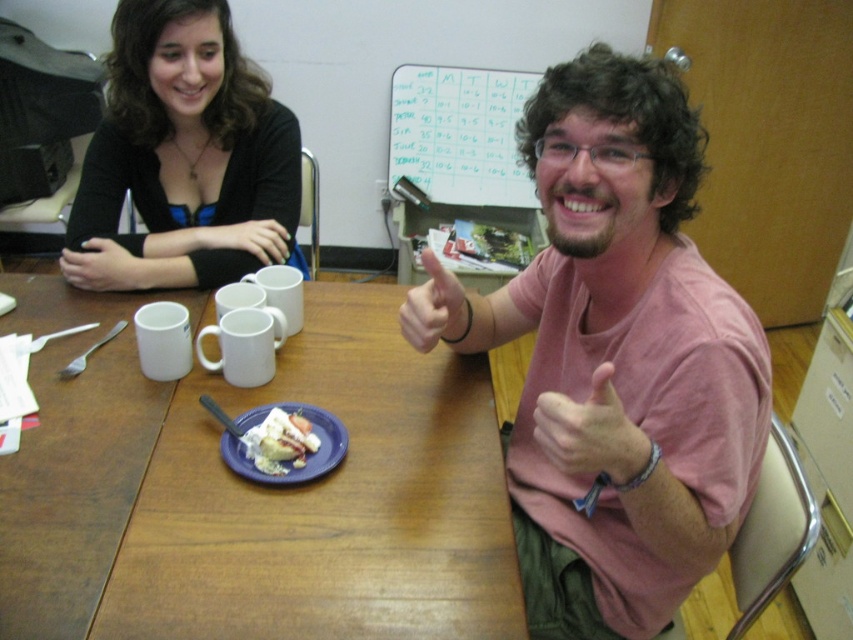
You are a delivery person who needs to place a small package between the pink cotton shirt at center and the black matte sweater at upper left. Can you fit the package if it measures 30 inches in length?

The distance between the pink cotton shirt at center and the black matte sweater at upper left is 29.75 inches, so the package measuring 30 inches in length cannot fit between them as it is slightly longer than the available space.

You are standing in the room and want to place a small vase on the wooden table at center. The coordinates of the table are given as point (260, 499). Is this point suitable for placing the vase?

The point (260, 499) is on the wooden table at center, so yes, this point is suitable for placing the vase.

You are a photographer taking a closeup shot of the scene. You want to focus on the pink matte hand at center and the black matte wristband at upper left. Which object should you adjust your focus to first if you want to capture both clearly in the same frame?

The pink matte hand at center is closer to the viewer than the black matte wristband at upper left, so you should focus on the pink matte hand at center first to ensure both are in focus.